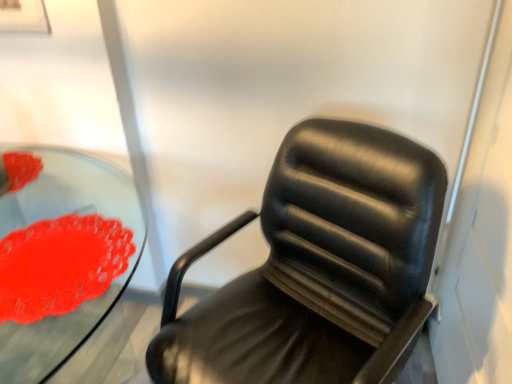
What are the coordinates of `rubberized red flower at left` in the screenshot? It's located at (60, 264).

In order to click on black leather chair at center in this screenshot , I will do (318, 268).

The width and height of the screenshot is (512, 384). In order to click on rubberized red flower at left in this screenshot , I will do `click(60, 264)`.

Which of these two, black leather chair at center or rubberized red flower at left, is wider?

black leather chair at center is wider.

Are black leather chair at center and rubberized red flower at left beside each other?

There is a gap between black leather chair at center and rubberized red flower at left.

Consider the image. Can you tell me how much black leather chair at center and rubberized red flower at left differ in facing direction?

They differ by 122 degrees in their facing directions.

Does black leather chair at center come in front of rubberized red flower at left?

Yes, black leather chair at center is in front of rubberized red flower at left.

Is point (295, 371) positioned behind point (136, 221)?

That is False.

Which is more to the right, black leather chair at center or transparent glass table at center?

black leather chair at center is more to the right.

Is black leather chair at center positioned beyond the bounds of transparent glass table at center?

black leather chair at center is positioned outside transparent glass table at center.

Is transparent glass table at center at the back of black leather chair at center?

No, black leather chair at center is not facing the opposite direction of transparent glass table at center.

From the image's perspective, which one is positioned lower, rubberized red flower at left or black leather chair at center?

black leather chair at center, from the image's perspective.

Is point (0, 285) in front of point (305, 155)?

Yes.

How different are the orientations of rubberized red flower at left and black leather chair at center in degrees?

There is a 122-degree angle between the facing directions of rubberized red flower at left and black leather chair at center.

How different are the orientations of transparent glass table at center and rubberized red flower at left in degrees?

There is a 1.88e-05-degree angle between the facing directions of transparent glass table at center and rubberized red flower at left.

Is transparent glass table at center facing towards rubberized red flower at left?

No, transparent glass table at center is not turned towards rubberized red flower at left.

Where is `flower lying on the right of transparent glass table at center`? The image size is (512, 384). flower lying on the right of transparent glass table at center is located at coordinates (60, 264).

Looking at this image, based on their sizes in the image, would you say transparent glass table at center is bigger or smaller than rubberized red flower at left?

Clearly, transparent glass table at center is larger in size than rubberized red flower at left.

Is rubberized red flower at left facing towards transparent glass table at center?

Yes, rubberized red flower at left is turned towards transparent glass table at center.

Locate an element on the screen. This screenshot has width=512, height=384. round table on the left of the rubberized red flower at left is located at coordinates click(x=55, y=216).

Is rubberized red flower at left shorter than transparent glass table at center?

Yes, rubberized red flower at left is shorter than transparent glass table at center.

Is point (14, 254) less distant than point (63, 197)?

Yes.

Would you say black leather chair at center is part of transparent glass table at center's contents?

No, black leather chair at center is located outside of transparent glass table at center.

From the image's perspective, is transparent glass table at center located above or below black leather chair at center?

Based on their image positions, transparent glass table at center is located beneath black leather chair at center.

Can you confirm if transparent glass table at center is positioned to the right of black leather chair at center?

No, transparent glass table at center is not to the right of black leather chair at center.

Can you tell me how much transparent glass table at center and black leather chair at center differ in facing direction?

They differ by 122 degrees in their facing directions.

I want to click on flower that appears behind the black leather chair at center, so click(60, 264).

Locate an element on the screen. This screenshot has height=384, width=512. chair located in front of the transparent glass table at center is located at coordinates (318, 268).

When comparing their distances from transparent glass table at center, does rubberized red flower at left or black leather chair at center seem closer?

The object closer to transparent glass table at center is rubberized red flower at left.

Looking at the image, which one is located further to black leather chair at center, rubberized red flower at left or transparent glass table at center?

Among the two, transparent glass table at center is located further to black leather chair at center.

When comparing their distances from rubberized red flower at left, does black leather chair at center or transparent glass table at center seem further?

transparent glass table at center is further to rubberized red flower at left.

From the image, which object appears to be nearer to black leather chair at center, transparent glass table at center or rubberized red flower at left?

rubberized red flower at left.

Based on their spatial positions, is transparent glass table at center or black leather chair at center closer to rubberized red flower at left?

black leather chair at center lies closer to rubberized red flower at left than the other object.

From the picture: Considering their positions, is black leather chair at center positioned closer to transparent glass table at center than rubberized red flower at left?

rubberized red flower at left.

Find the location of a particular element. flower located between transparent glass table at center and black leather chair at center in the left-right direction is located at coordinates (60, 264).